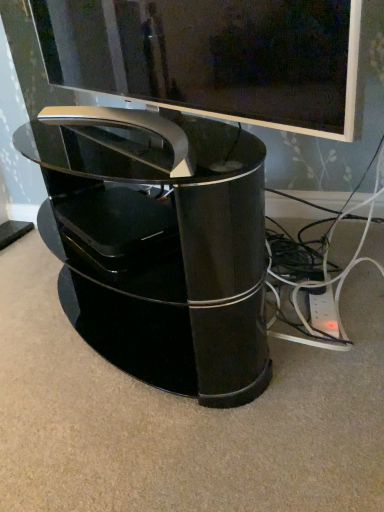
Question: Considering the positions of glossy black tv at upper center and glossy black tv stand at center in the image, is glossy black tv at upper center wider or thinner than glossy black tv stand at center?

Choices:
 (A) thin
 (B) wide

Answer: (A)

Question: Based on their sizes in the image, would you say glossy black tv at upper center is bigger or smaller than glossy black tv stand at center?

Choices:
 (A) small
 (B) big

Answer: (A)

Question: Choose the correct answer: Is glossy black tv at upper center inside glossy black tv stand at center or outside it?

Choices:
 (A) inside
 (B) outside

Answer: (B)

Question: Relative to glossy black tv at upper center, is glossy black tv stand at center in front or behind?

Choices:
 (A) front
 (B) behind

Answer: (B)

Question: Considering the positions of glossy black tv stand at center and glossy black tv at upper center in the image, is glossy black tv stand at center wider or thinner than glossy black tv at upper center?

Choices:
 (A) thin
 (B) wide

Answer: (B)

Question: Is point (228, 156) positioned closer to the camera than point (208, 13)?

Choices:
 (A) closer
 (B) farther

Answer: (B)

Question: From a real-world perspective, relative to glossy black tv at upper center, is glossy black tv stand at center vertically above or below?

Choices:
 (A) above
 (B) below

Answer: (B)